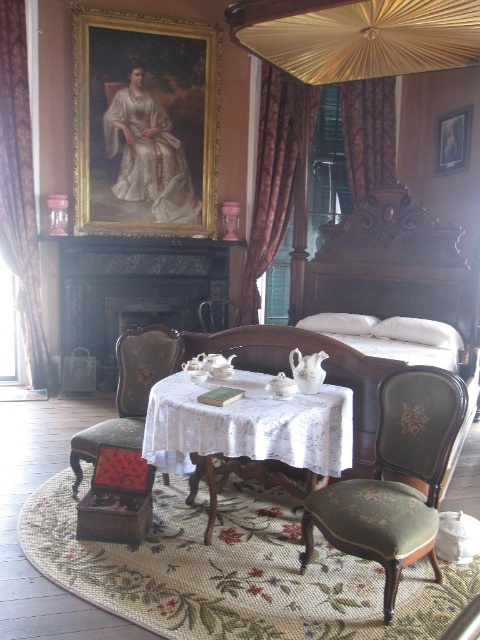
Question: Which of the following is the closest to the observer?

Choices:
 (A) black marble fireplace at center
 (B) green fabric armchair at lower right
 (C) velvet green armchair at center

Answer: (B)

Question: Does velvet green armchair at center have a smaller size compared to velvet burgundy curtain at upper right?

Choices:
 (A) yes
 (B) no

Answer: (B)

Question: Which is nearer to the black marble fireplace at center?

Choices:
 (A) velvet burgundy curtain at upper right
 (B) silky brown curtain at left
 (C) wooden armchair at center

Answer: (C)

Question: Where is black marble fireplace at center located in relation to white lace table at center in the image?

Choices:
 (A) right
 (B) left

Answer: (B)

Question: Which object appears farthest from the camera in this image?

Choices:
 (A) green fabric armchair at lower right
 (B) wooden armchair at center
 (C) silky brown curtain at left
 (D) brown velvet curtain at center

Answer: (B)

Question: Can you confirm if green fabric armchair at lower right is thinner than velvet burgundy curtain at upper right?

Choices:
 (A) no
 (B) yes

Answer: (A)